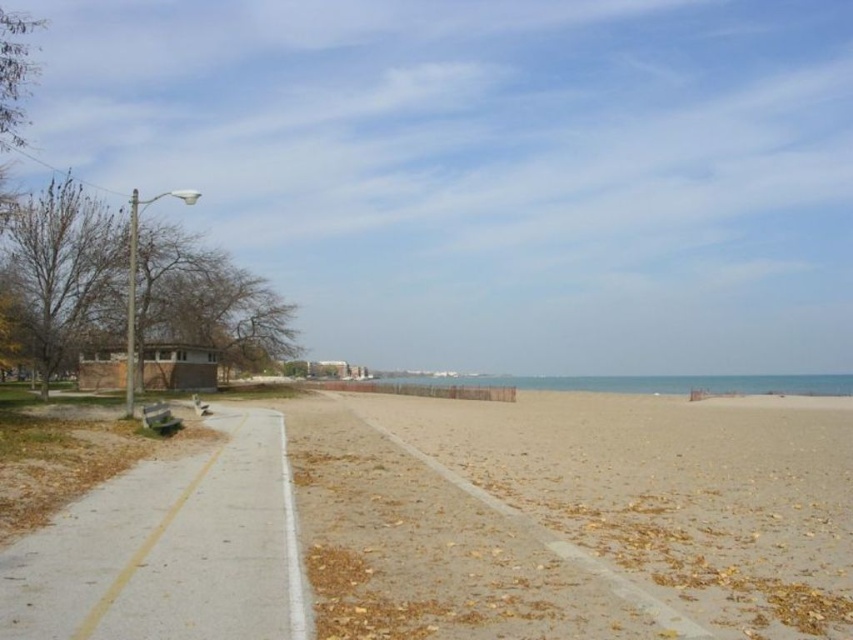
Is point (195, 538) closer to viewer compared to point (155, 403)?

Yes, point (195, 538) is closer to viewer.

Does point (109, 515) come behind point (160, 404)?

No, it is not.

Image resolution: width=853 pixels, height=640 pixels. Identify the location of concrete at left. (170, 548).

Who is more forward, (796, 545) or (254, 592)?

Positioned in front is point (254, 592).

Locate an element on the screen. brown sandy beach at center is located at coordinates (662, 493).

Locate an element on the screen. The image size is (853, 640). brown sandy beach at center is located at coordinates (662, 493).

Which of these two, brown sandy beach at center or wooden park bench at lower left, stands taller?

brown sandy beach at center is taller.

Is brown sandy beach at center smaller than wooden park bench at lower left?

Actually, brown sandy beach at center might be larger than wooden park bench at lower left.

Does point (660, 618) lie behind point (160, 413)?

No, (660, 618) is in front of (160, 413).

Identify the location of brown sandy beach at center. Image resolution: width=853 pixels, height=640 pixels. 662,493.